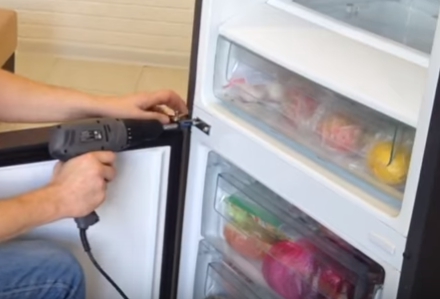
At what (x,y) coordinates should I click in order to perform the action: click on clear shelves. Please return your answer as a coordinate pair (x, y). Looking at the image, I should click on (217, 277), (258, 219), (303, 124), (408, 20).